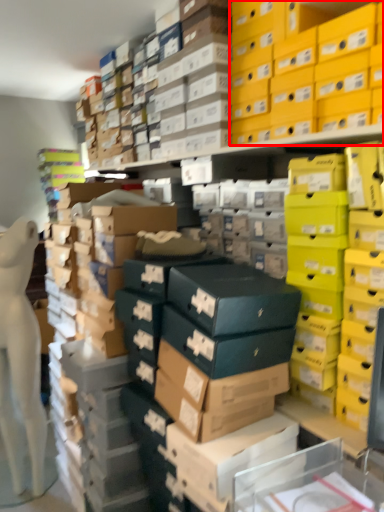
Question: From the image's perspective, where is storage box (annotated by the red box) located in relation to cardboard box in the image?

Choices:
 (A) above
 (B) below

Answer: (A)